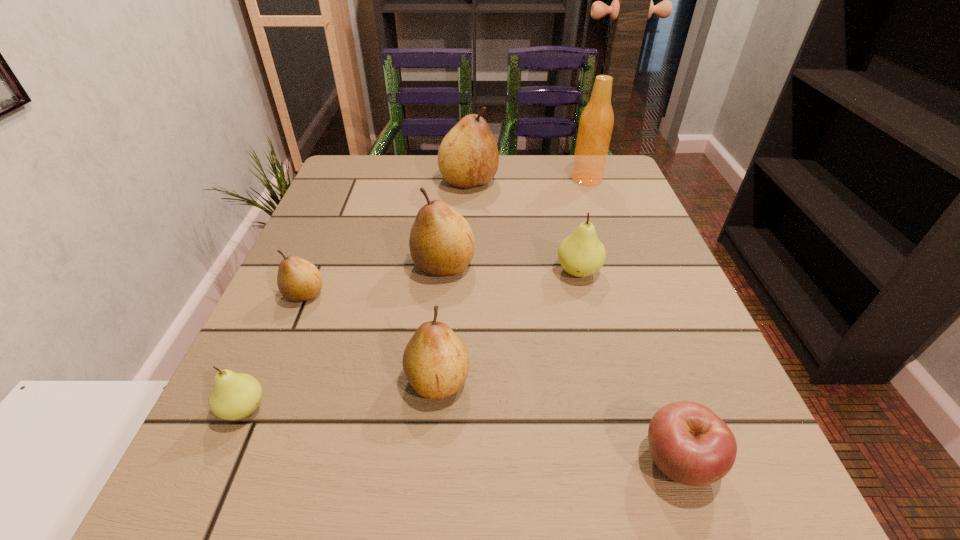
Find the location of `the second closest brown pear to the third tallest object`. the second closest brown pear to the third tallest object is located at coordinates (436, 363).